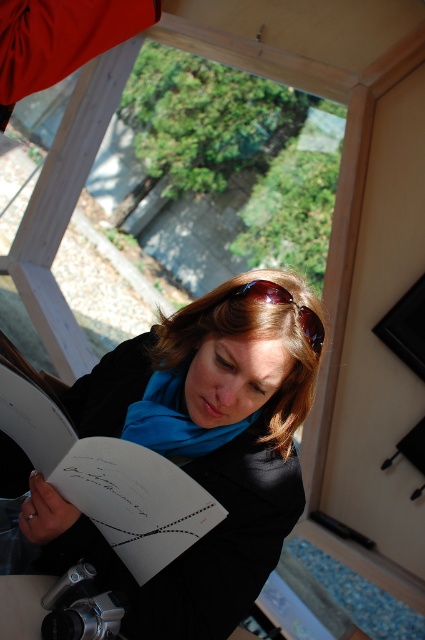
Describe the element at coordinates (200, 448) in the screenshot. I see `black matte jacket at center` at that location.

Is point (201, 316) in front of point (93, 513)?

No, (201, 316) is behind (93, 513).

Who is more distant from viewer, (294, 276) or (214, 502)?

Positioned behind is point (294, 276).

At what (x,y) coordinates should I click in order to perform the action: click on black matte jacket at center. Please return your answer as a coordinate pair (x, y). Image resolution: width=425 pixels, height=640 pixels. Looking at the image, I should click on (200, 448).

The height and width of the screenshot is (640, 425). Identify the location of black matte jacket at center. (200, 448).

Does point (240, 616) come closer to viewer compared to point (187, 426)?

Yes, point (240, 616) is in front of point (187, 426).

Between point (248, 305) and point (141, 433), which one is positioned in front?

Point (248, 305)

This screenshot has height=640, width=425. In order to click on black matte jacket at center in this screenshot , I will do 200,448.

Measure the distance between black matte jacket at center and brown leather sunglasses at center.

black matte jacket at center and brown leather sunglasses at center are 11.08 inches apart.

Based on the photo, which of these two, black matte jacket at center or brown leather sunglasses at center, stands shorter?

With less height is brown leather sunglasses at center.

This screenshot has height=640, width=425. I want to click on black matte jacket at center, so click(200, 448).